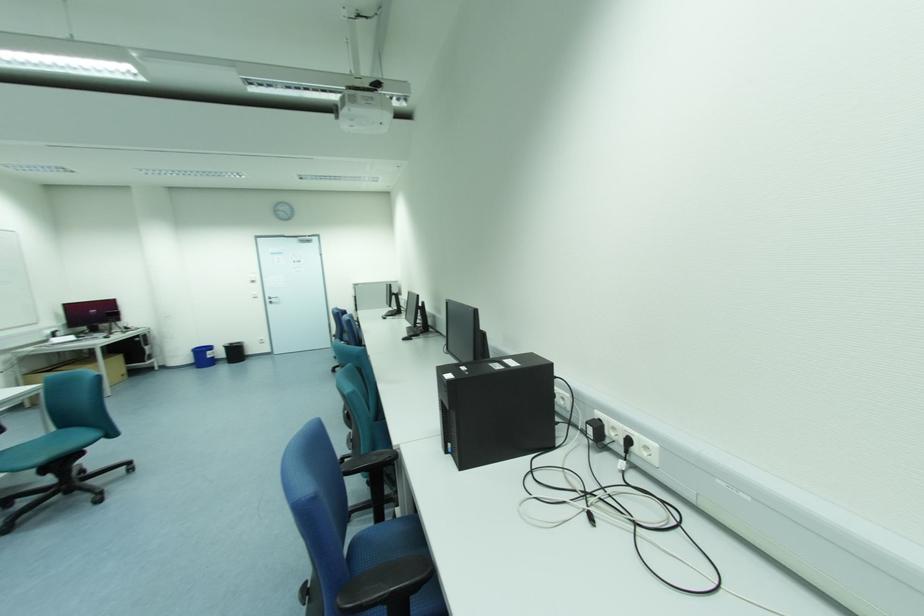
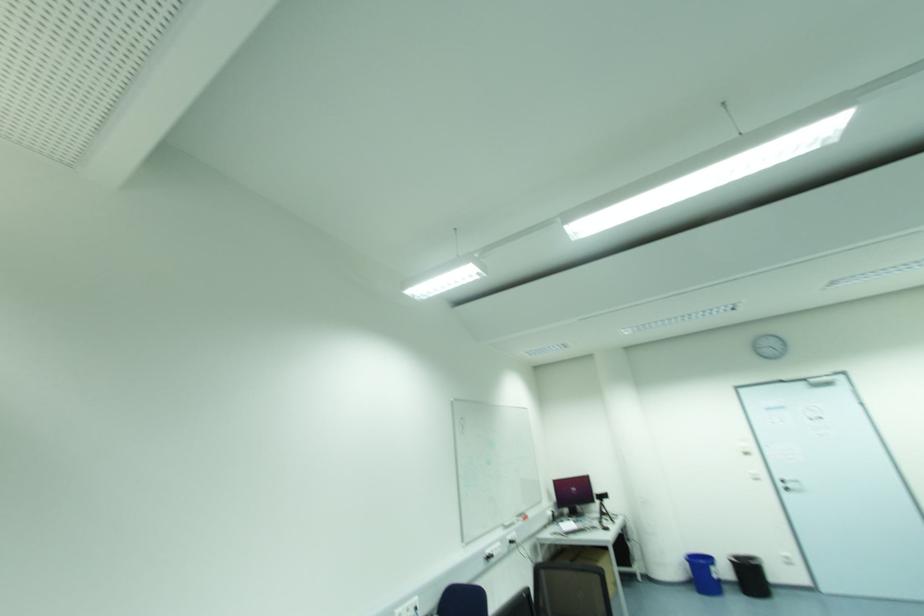
Locate, in the second image, the point that corresponds to [274,301] in the first image.

(789, 485)